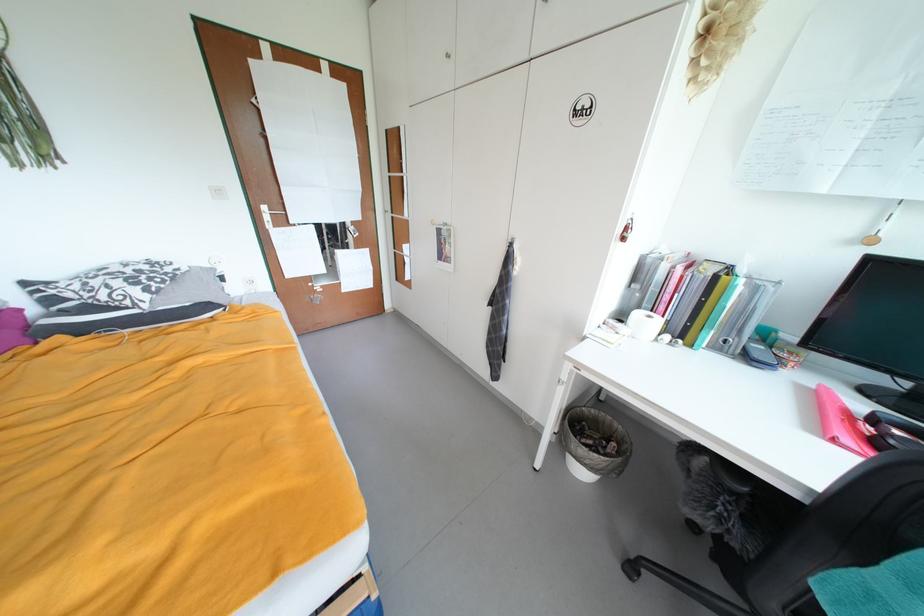
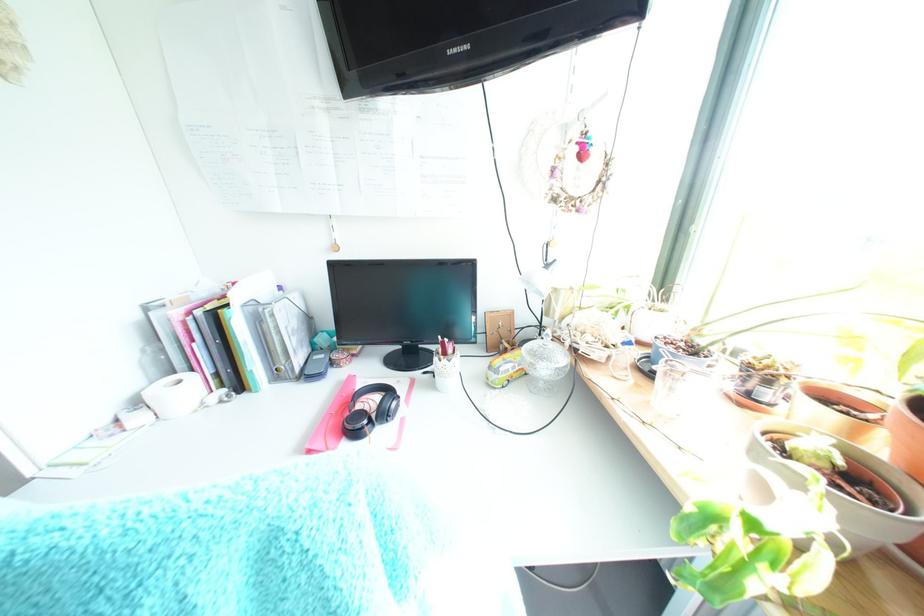
Question: The images are taken continuously from a first-person perspective. In which direction is your viewpoint rotating?

Choices:
 (A) Left
 (B) Right
 (C) Up
 (D) Down

Answer: (B)